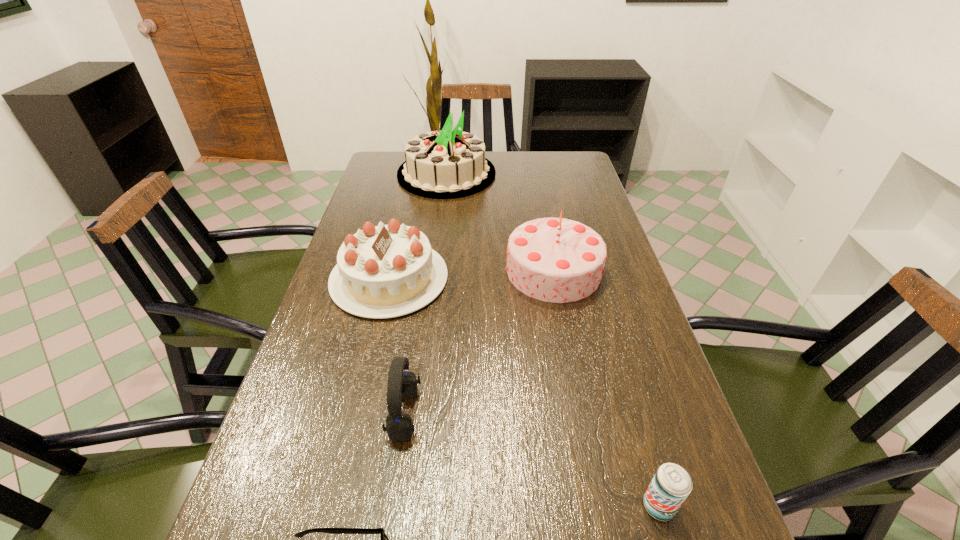
Find the location of a particular element. Image resolution: width=960 pixels, height=540 pixels. free space located 0.090m on the back of the shortest birthday cake is located at coordinates (401, 226).

Find the location of `vacant space located on the headband of the fourth farthest object`. vacant space located on the headband of the fourth farthest object is located at coordinates (490, 414).

The height and width of the screenshot is (540, 960). In order to click on vacant space situated on the back of the fifth tallest object in this screenshot , I will do `click(608, 330)`.

Where is `object that is positioned at the far edge`? This screenshot has width=960, height=540. object that is positioned at the far edge is located at coordinates (444, 164).

The image size is (960, 540). In order to click on birthday cake located in the right edge section of the desktop in this screenshot , I will do `click(559, 260)`.

This screenshot has height=540, width=960. In order to click on beer can present at the right edge in this screenshot , I will do `click(671, 485)`.

In order to click on object positioned at the far left corner in this screenshot , I will do `click(444, 164)`.

Identify the location of vacant position at the left edge of the desktop. (391, 208).

Where is `vacant space at the right edge`? The image size is (960, 540). vacant space at the right edge is located at coordinates (620, 267).

Locate an element on the screen. Image resolution: width=960 pixels, height=540 pixels. free spot between the second tallest birthday cake and the fifth tallest object is located at coordinates (607, 388).